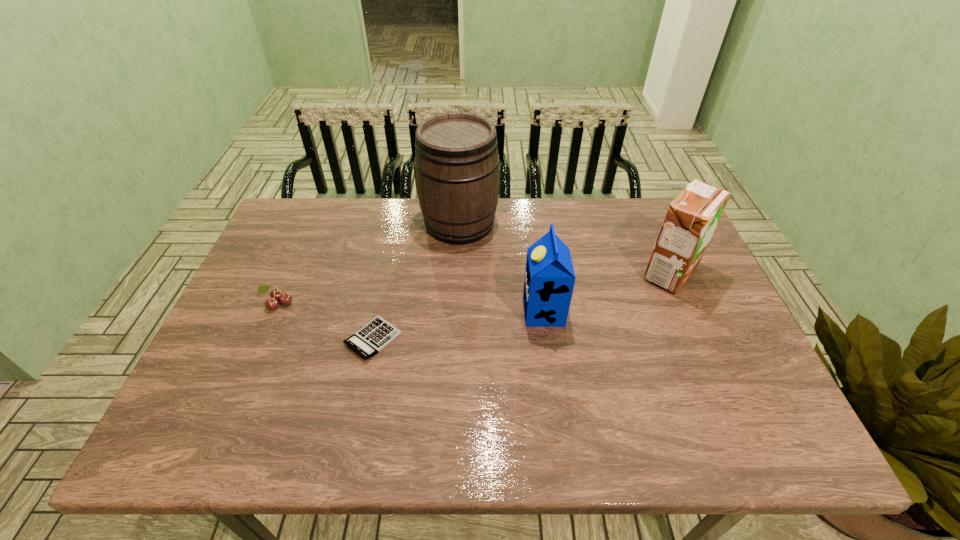
Image resolution: width=960 pixels, height=540 pixels. What are the coordinates of `object at the left edge` in the screenshot? It's located at (276, 294).

Locate an element on the screen. The width and height of the screenshot is (960, 540). object present at the right edge is located at coordinates (692, 217).

You are a GUI agent. You are given a task and a screenshot of the screen. Output one action in this format:
    pyautogui.click(x=<x>, y=<y>)
    Task: Click on the vacant space at the far edge of the desktop
    The height and width of the screenshot is (540, 960).
    Given the screenshot: What is the action you would take?
    pyautogui.click(x=390, y=227)

Locate an element on the screen. The height and width of the screenshot is (540, 960). vacant space at the near edge is located at coordinates (506, 435).

You are a GUI agent. You are given a task and a screenshot of the screen. Output one action in this format:
    pyautogui.click(x=<x>, y=<y>)
    Task: Click on the free space at the left edge of the desktop
    
    Given the screenshot: What is the action you would take?
    pyautogui.click(x=301, y=291)

Identify the location of free space at the right edge of the desktop. (713, 393).

Where is `free region at the far left corner of the desktop`? Image resolution: width=960 pixels, height=540 pixels. free region at the far left corner of the desktop is located at coordinates (300, 206).

Image resolution: width=960 pixels, height=540 pixels. I want to click on free space at the far right corner of the desktop, so click(x=627, y=200).

At what (x,y) coordinates should I click in order to perform the action: click on free space between the fourth tallest object and the shortest object. Please return your answer as a coordinate pair (x, y). Looking at the image, I should click on (325, 321).

What are the coordinates of `free area in between the leftmost object and the farthest object` in the screenshot? It's located at (369, 263).